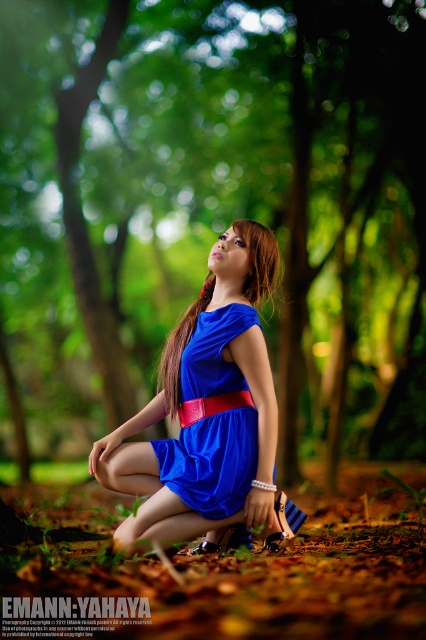
Who is more distant from viewer, (204, 323) or (270, 250)?

Positioned behind is point (270, 250).

Between blue satin dress at center and brown smooth hair at center, which one appears on the right side from the viewer's perspective?

Positioned to the right is brown smooth hair at center.

You are a GUI agent. You are given a task and a screenshot of the screen. Output one action in this format:
    pyautogui.click(x=<x>, y=<y>)
    Task: Click on the blue satin dress at center
    The image size is (426, 640).
    Given the screenshot: What is the action you would take?
    pyautogui.click(x=213, y=419)

Can you confirm if blue matte dress at center is positioned above brown smooth hair at center?

No.

Is blue matte dress at center taller than brown smooth hair at center?

Yes.

Which is behind, point (229, 372) or point (250, 289)?

Point (250, 289)

The width and height of the screenshot is (426, 640). In order to click on blue matte dress at center in this screenshot , I will do click(x=207, y=410).

Who is lower down, blue matte dress at center or blue satin dress at center?

blue satin dress at center is lower down.

Looking at this image, is blue matte dress at center positioned at the back of blue satin dress at center?

No, it is in front of blue satin dress at center.

Who is more forward, (212, 540) or (195, 392)?

Positioned in front is point (195, 392).

Where is `blue matte dress at center`? The height and width of the screenshot is (640, 426). blue matte dress at center is located at coordinates (207, 410).